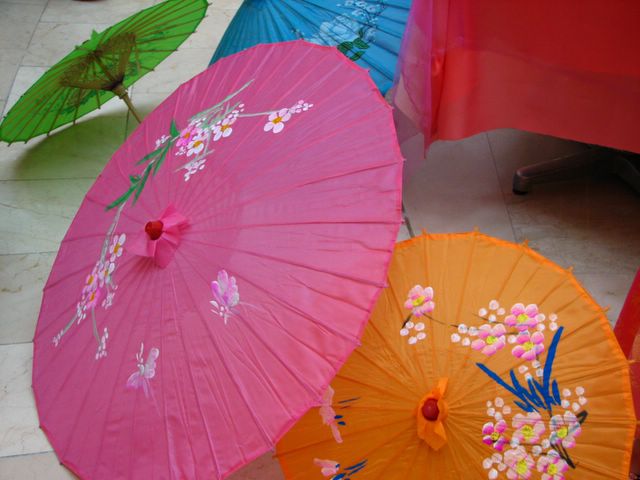
Locate an element on the screen. floor is located at coordinates (48, 172).